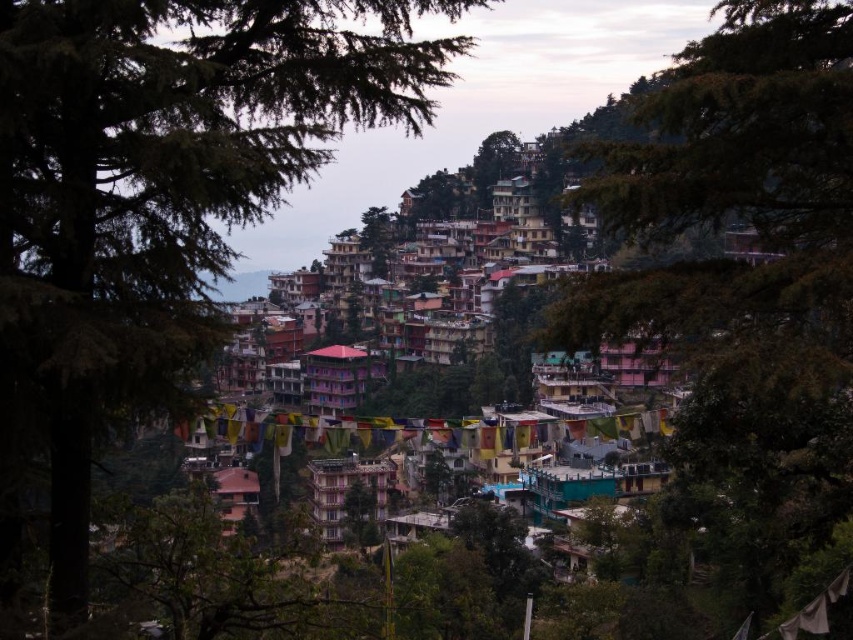
Question: Which point is closer to the camera?

Choices:
 (A) green textured tree at upper left
 (B) green leafy tree at center

Answer: (A)

Question: Does green textured tree at upper left have a lesser width compared to green leafy tree at center?

Choices:
 (A) no
 (B) yes

Answer: (B)

Question: Is green textured tree at upper left wider than green leafy tree at center?

Choices:
 (A) yes
 (B) no

Answer: (B)

Question: Can you confirm if green textured tree at upper left is positioned to the right of green leafy tree at center?

Choices:
 (A) yes
 (B) no

Answer: (B)

Question: Which point is farther from the camera taking this photo?

Choices:
 (A) (97, 84)
 (B) (769, 595)

Answer: (B)